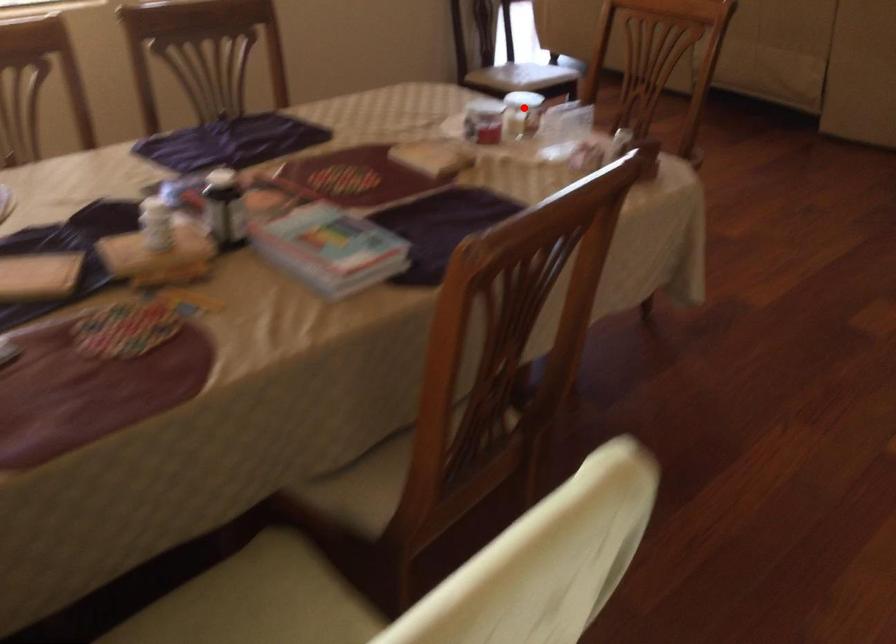
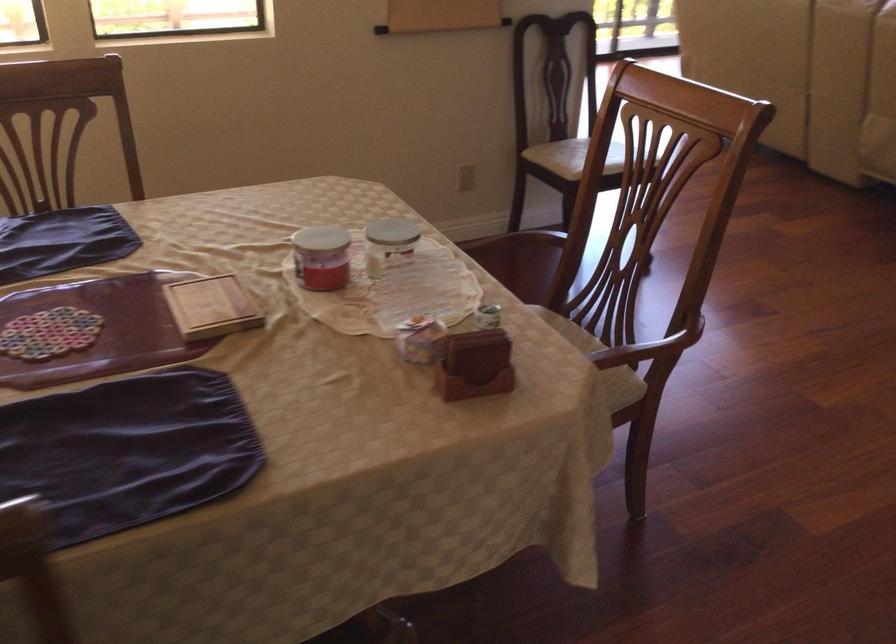
Locate, in the second image, the point that corresponds to the highlighted location in the first image.

(389, 243)